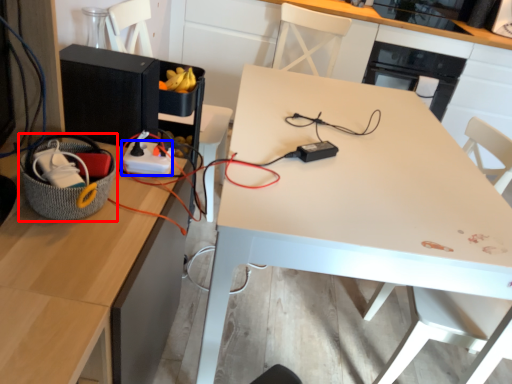
Question: Which of the following is the farthest to the observer, basket (highlighted by a red box) or extension cord (highlighted by a blue box)?

Choices:
 (A) basket
 (B) extension cord

Answer: (B)